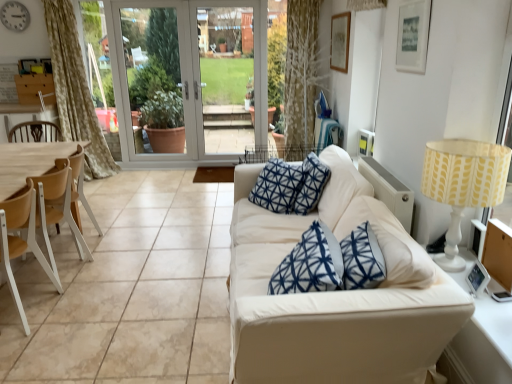
This screenshot has width=512, height=384. I want to click on vacant area located to the right-hand side of light brown wood armchair at left, so click(x=137, y=283).